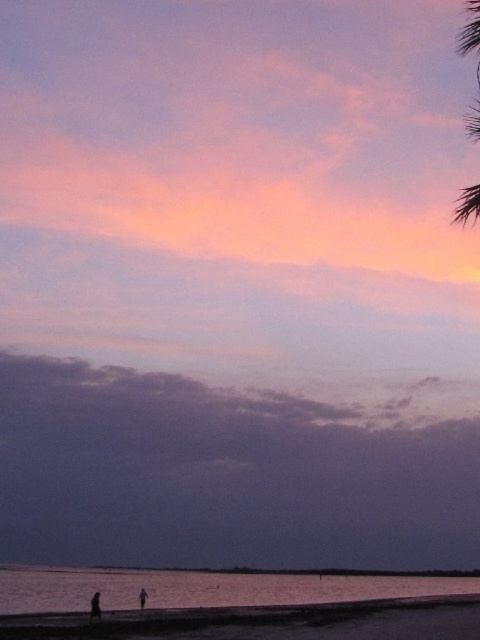
You are a photographer planning to capture the sunset reflection on the silvery water at lower center. To ensure the reflection is centered in your photo, where should you aim your camera? Use coordinates from 0 to 1 for both x and y axes, with the origin at the bottom left corner of the image.

You should aim your camera at the coordinates point of silvery water at lower center, which is at point (203,588). So the reflection will be centered at that point.

You are a photographer trying to capture the sunset. You notice the silvery water at lower center and the green leafy palm tree at upper right in your frame. Which object appears taller in the photo?

The green leafy palm tree at upper right appears taller than the silvery water at lower center in the photo.

You are standing at the beach watching the sunset and see two points in the image. The first point is at coordinate point (291,595) and the second is at point (92,608). Which point is closer to you?

Point (92,608) is closer to you because point (291,595) is further away from the camera than point (92,608).